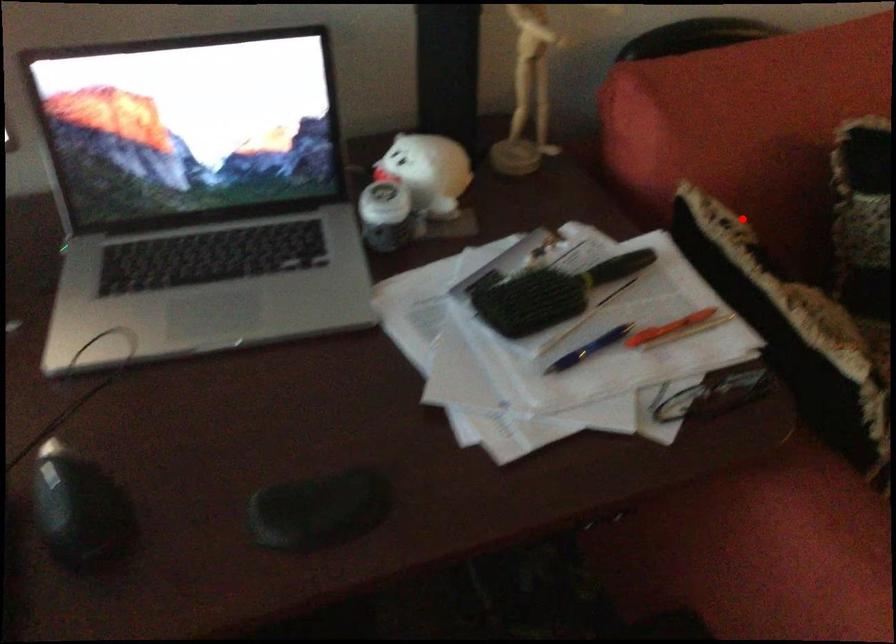
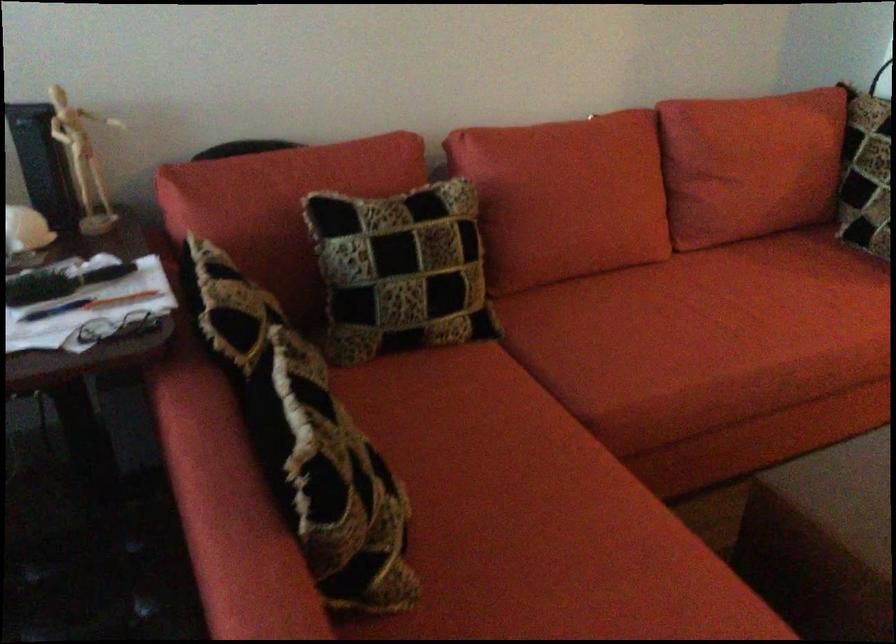
Question: A red point is marked in image1. In image2, is the corresponding 3D point closer to the camera or farther? Reply with the corresponding letter.

Choices:
 (A) The corresponding 3D point is closer.
 (B) The corresponding 3D point is farther.

Answer: (B)